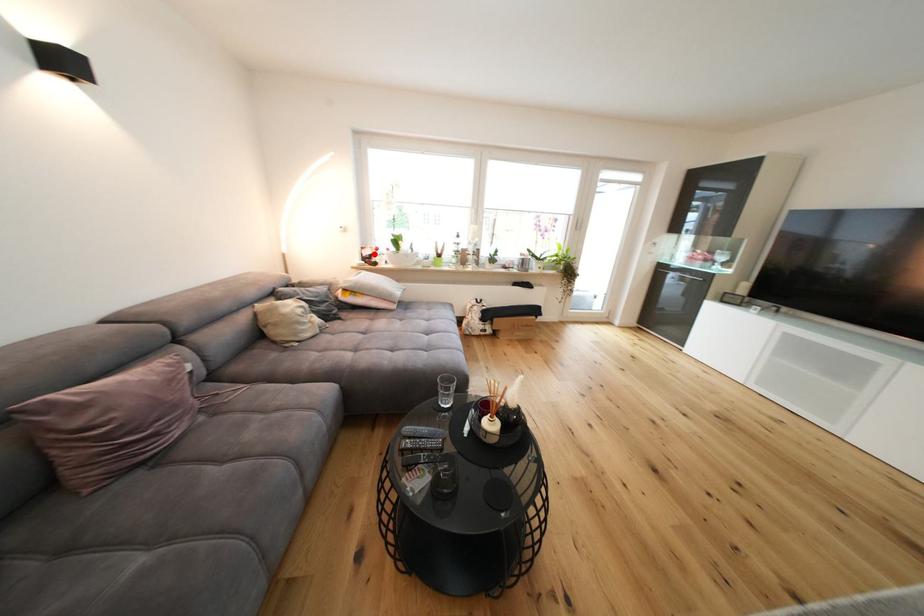
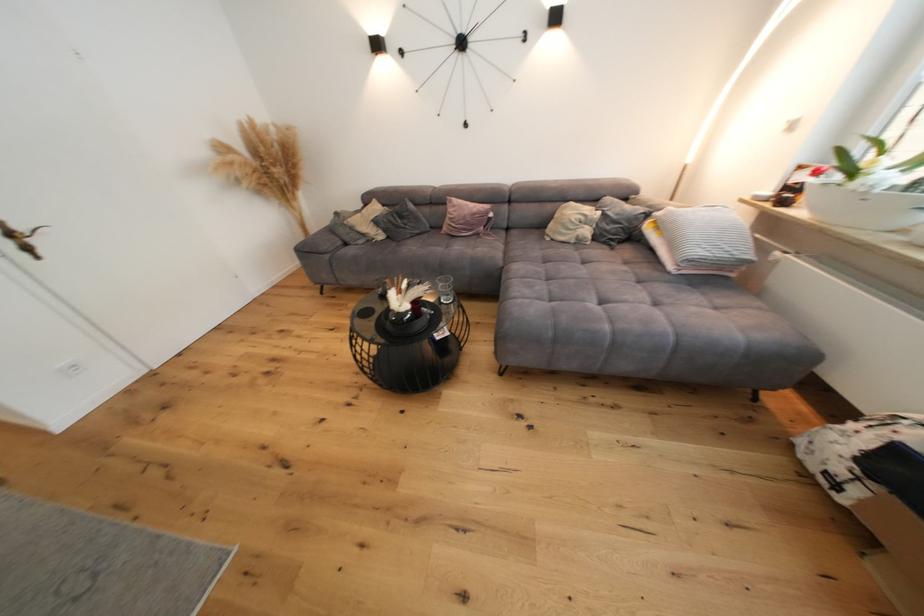
Question: I am providing you with two images of the same scene from different viewpoints. Image1 has a red point marked. In image2, the corresponding 3D location appears at what relative position? Reply with the corresponding letter.

Choices:
 (A) Closer
 (B) Farther

Answer: (B)